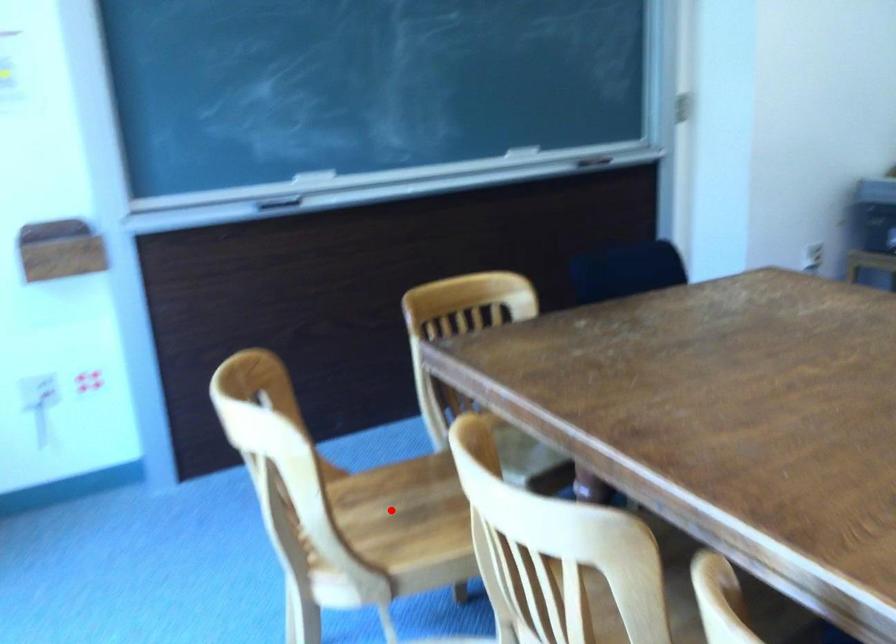
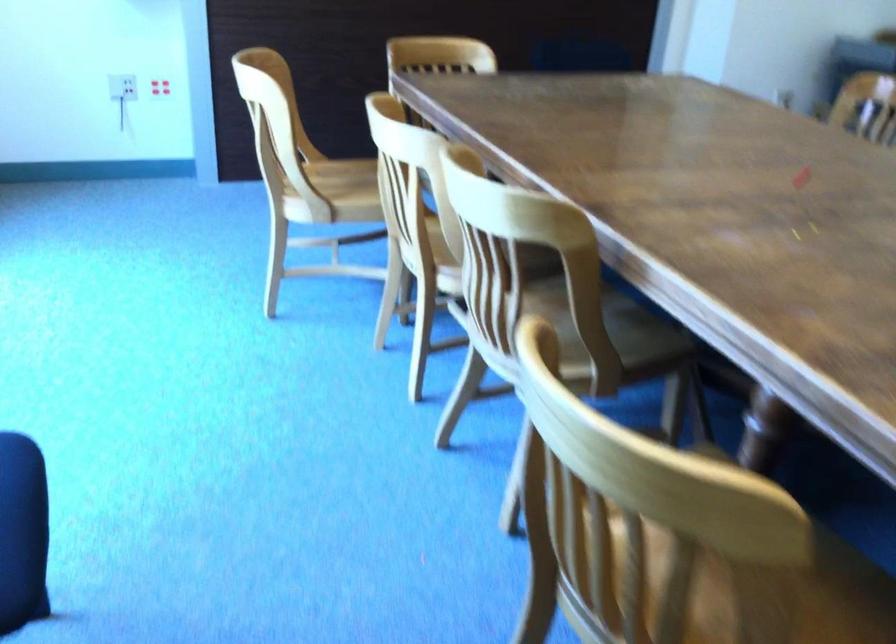
In the second image, find the point that corresponds to the highlighted location in the first image.

(347, 180)